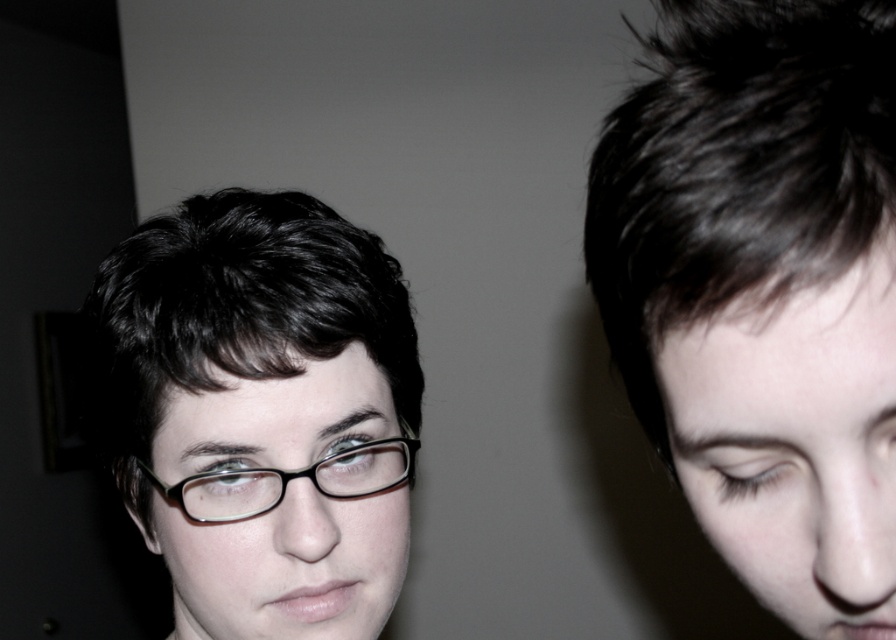
You are a photographer adjusting the focus on your camera. You notice two objects in the scene described above. One is the person on the left wearing glasses, and the other is the point marked at coordinate (261, 412). Which object is closer to the camera?

The point marked at coordinate (261, 412) is closer to the camera because it marks the matte black glasses at left, which are part of the person on the left and therefore in the foreground.

You are a photographer reviewing a portrait. You notice the dark brown hair at upper right and the black plastic glasses at center. Which object is positioned further to the right in the image?

The dark brown hair at upper right is positioned further to the right compared to the black plastic glasses at center.